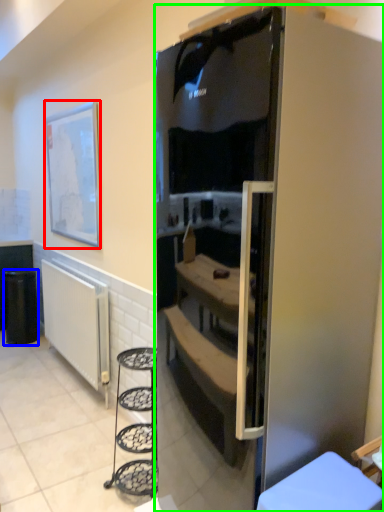
Question: Which object is the farthest from picture frame (highlighted by a red box)? Choose among these: trash bin/can (highlighted by a blue box) or refrigerator (highlighted by a green box).

Choices:
 (A) trash bin/can
 (B) refrigerator

Answer: (B)